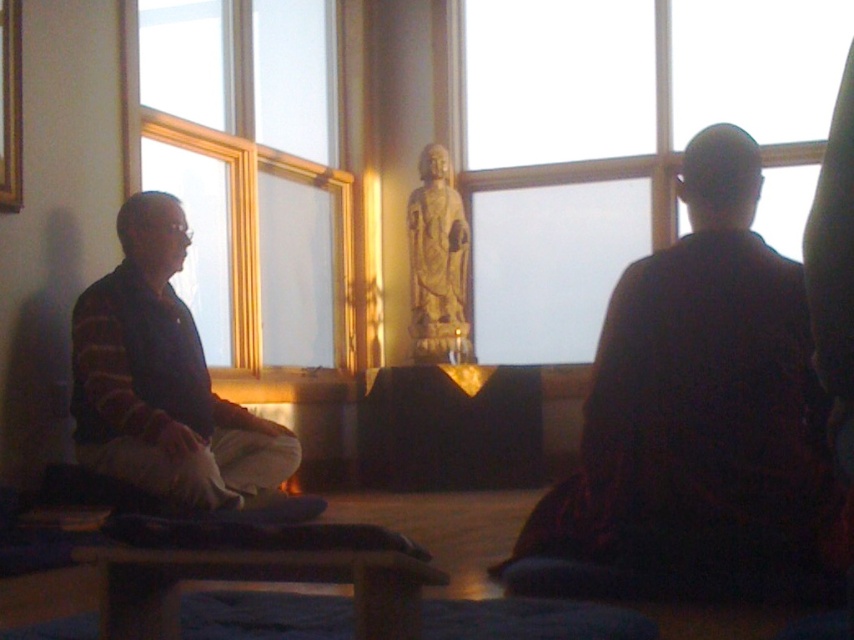
You are a visitor in the room and want to know which object at the center is taller. Which one is taller between the transparent glass window at center and the stone statue at center?

The transparent glass window at center is taller than the stone statue at center according to the description.

You are standing in the room and want to let more natural light into the space. Which object should you move closer to the transparent glass window at center to achieve this?

The transparent glass window at center is already positioned at point (619, 141), so moving other objects closer to it might not increase the amount of light entering the room. However, if you want to redirect or diffuse the light, you could consider placing reflective or translucent objects near the window.

You are an interior designer planning to place a large potted plant between the transparent glass window at center and the transparent glass window at upper left. Given that the plant requires a space wider than the smaller window, will it fit between them?

The transparent glass window at center is wider than the transparent glass window at upper left. Since the plant requires a space wider than the smaller window, the space between them may be sufficient if the distance between the two windows is greater than the width of the smaller one. However, without knowing the exact distance between the windows, we cannot confirm if the plant will fit.